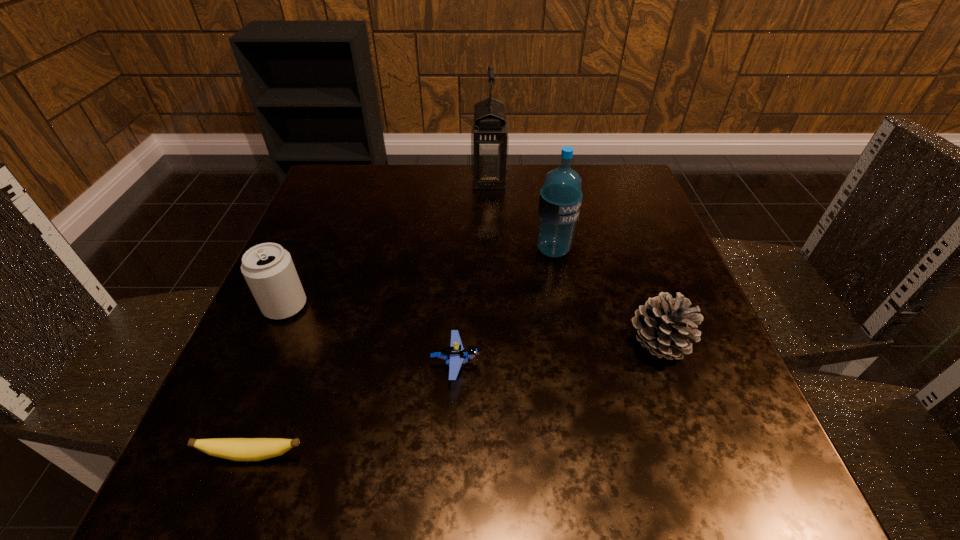
Image resolution: width=960 pixels, height=540 pixels. I want to click on banana that is at the left edge, so click(x=237, y=449).

You are a GUI agent. You are given a task and a screenshot of the screen. Output one action in this format:
    pyautogui.click(x=<x>, y=<y>)
    Task: Click on the object that is at the right edge
    
    Given the screenshot: What is the action you would take?
    pyautogui.click(x=663, y=324)

The image size is (960, 540). I want to click on object positioned at the near left corner, so click(237, 449).

Identify the location of vacant point at the far edge. (465, 186).

Identify the location of vacant space at the near edge of the desktop. (372, 489).

You are a GUI agent. You are given a task and a screenshot of the screen. Output one action in this format:
    pyautogui.click(x=<x>, y=<y>)
    Task: Click on the vacant space at the left edge of the desktop
    The width and height of the screenshot is (960, 540).
    Given the screenshot: What is the action you would take?
    pyautogui.click(x=223, y=430)

Image resolution: width=960 pixels, height=540 pixels. Find the location of `free space at the right edge of the desktop`. free space at the right edge of the desktop is located at coordinates (643, 289).

In the image, there is a desktop. Find the location of `vacant area at the far left corner`. vacant area at the far left corner is located at coordinates (372, 185).

This screenshot has width=960, height=540. What are the coordinates of `blank space at the far right corner` in the screenshot? It's located at (592, 200).

This screenshot has width=960, height=540. In the image, there is a desktop. Identify the location of vacant space at the near right corner. (764, 480).